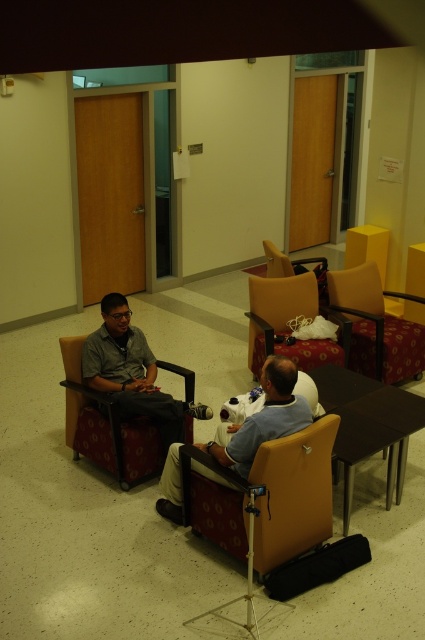
Based on the photo, you are standing in the lounge area and want to move from point A to point B. Point A is at coordinate point (110, 426) and point B is at coordinate point (266, 380). Since you can only move forward, will you have to walk towards or away from the camera to reach point B from point A?

To move from point A at coordinate point (110, 426) to point B at coordinate point (266, 380), you will have to walk away from the camera because point A is further to the camera than point B.